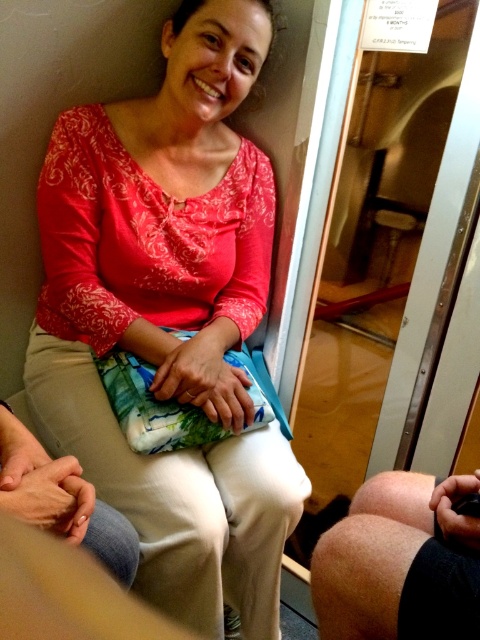
You are a passenger on a train and want to move from your seat to the exit door located at point (x=317, y=586). There is an obstacle at point (x=135, y=218). Can you safely walk around the obstacle to reach the door?

Point (x=135, y=218) is behind point (x=317, y=586), so the obstacle is located behind the exit door. Therefore, you can safely walk towards the door without needing to go around the obstacle.

You are a passenger on a train and need to place a 12 inch long laptop bag between the matte red blouse at center and the smooth skin knee at lower right. Can the bag fit in the space between them?

The distance between the matte red blouse at center and the smooth skin knee at lower right is 18.40 inches. Since the laptop bag is 12 inches long, there is enough space to fit it between them.

Consider the image. You are standing inside a subway car and want to reach a point in the scene marked as point (100, 477). If you can only move forward in a straight line, will you be able to reach that point without any obstacles?

The distance between you and point (100, 477) is 3.53 feet. Since there are no obstacles mentioned in the scene description, you can move forward in a straight line to reach it.